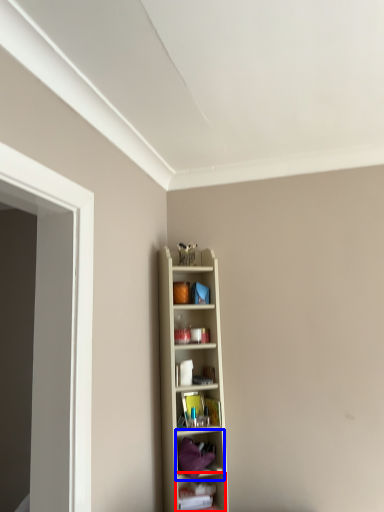
Question: Which point is closer to the camera, shelf (highlighted by a red box) or shelf (highlighted by a blue box)?

Choices:
 (A) shelf
 (B) shelf

Answer: (B)